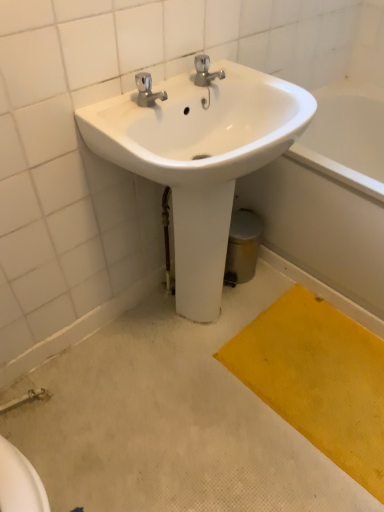
Find the location of a particular element. The width and height of the screenshot is (384, 512). vacant region below yellow fabric doormat at lower right (from a real-world perspective) is located at coordinates (324, 384).